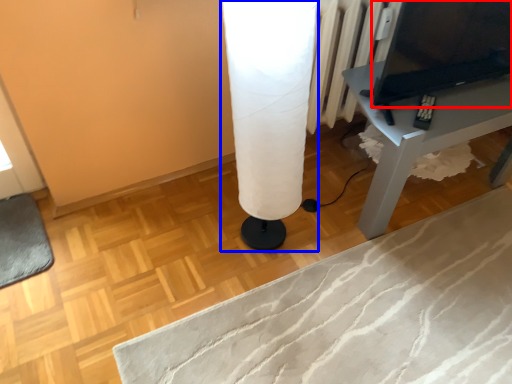
Question: Which point is closer to the camera, computer (highlighted by a red box) or table lamp (highlighted by a blue box)?

Choices:
 (A) computer
 (B) table lamp

Answer: (B)